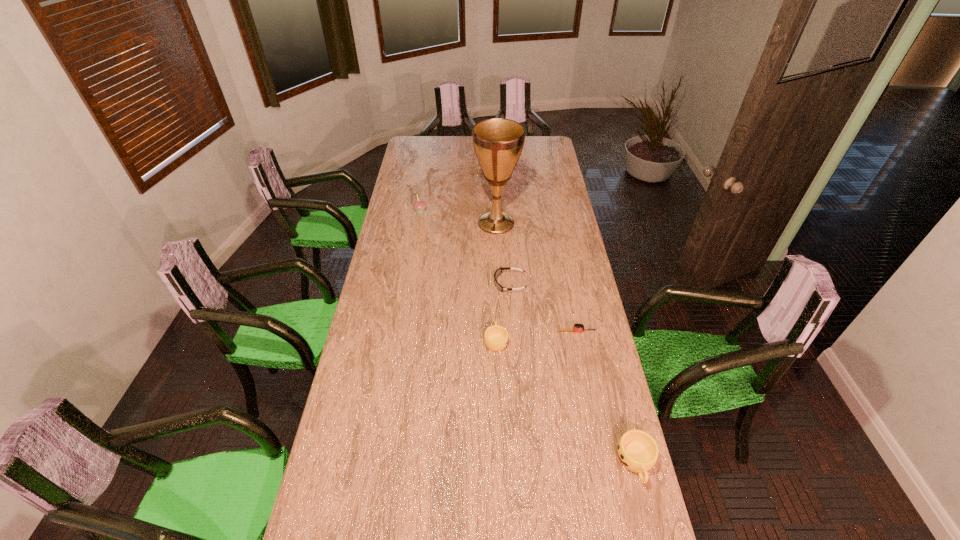
The width and height of the screenshot is (960, 540). I want to click on the farther cup, so click(496, 337).

What are the coordinates of `the shorter cup` in the screenshot? It's located at (496, 337).

Locate an element on the screen. This screenshot has width=960, height=540. the right cup is located at coordinates (637, 451).

The height and width of the screenshot is (540, 960). In order to click on the taller cup in this screenshot , I will do `click(637, 451)`.

At what (x,y) coordinates should I click in order to perform the action: click on the tallest object. Please return your answer as a coordinate pair (x, y). The width and height of the screenshot is (960, 540). Looking at the image, I should click on (498, 143).

In order to click on the third farthest object in this screenshot , I will do `click(499, 270)`.

Find the location of a particular element. This screenshot has width=960, height=540. goggles is located at coordinates tap(499, 270).

This screenshot has width=960, height=540. I want to click on the second tallest object, so click(419, 205).

At what (x,y) coordinates should I click in order to perform the action: click on cupcake. Please return your answer as a coordinate pair (x, y). This screenshot has height=540, width=960. Looking at the image, I should click on (419, 205).

Locate an element on the screen. This screenshot has width=960, height=540. the shortest object is located at coordinates (577, 327).